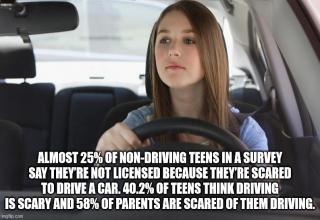
Where is `black seat`? Image resolution: width=320 pixels, height=220 pixels. black seat is located at coordinates (25, 78).